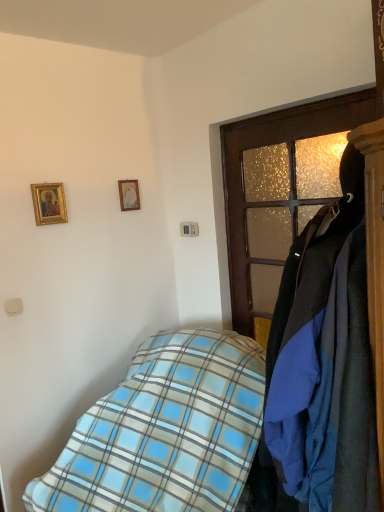
Question: Is gold-framed painting at upper left, the 1th picture frame from the left, taller than wooden door at right?

Choices:
 (A) yes
 (B) no

Answer: (B)

Question: From the image's perspective, is gold-framed painting at upper left, which is counted as the 2th picture frame, starting from the right, beneath wooden door at right?

Choices:
 (A) yes
 (B) no

Answer: (B)

Question: Is gold-framed painting at upper left, acting as the second picture frame starting from the back, located outside wooden door at right?

Choices:
 (A) yes
 (B) no

Answer: (A)

Question: Considering the relative sizes of gold-framed painting at upper left, acting as the second picture frame starting from the back, and wooden door at right in the image provided, is gold-framed painting at upper left, acting as the second picture frame starting from the back, shorter than wooden door at right?

Choices:
 (A) no
 (B) yes

Answer: (B)

Question: Considering the relative sizes of gold-framed painting at upper left, which is the 1th picture frame in front-to-back order, and wooden door at right in the image provided, is gold-framed painting at upper left, which is the 1th picture frame in front-to-back order, wider than wooden door at right?

Choices:
 (A) yes
 (B) no

Answer: (B)

Question: Is point (279, 243) closer or farther from the camera than point (62, 201)?

Choices:
 (A) farther
 (B) closer

Answer: (B)

Question: From a real-world perspective, is wooden door at right positioned above or below gold-framed painting at upper left, which is counted as the 2th picture frame, starting from the right?

Choices:
 (A) above
 (B) below

Answer: (B)

Question: Is wooden door at right wider or thinner than gold-framed painting at upper left, which is counted as the 2th picture frame, starting from the right?

Choices:
 (A) thin
 (B) wide

Answer: (B)

Question: In the image, is wooden door at right positioned in front of or behind gold-framed painting at upper left, the 1th picture frame from the left?

Choices:
 (A) front
 (B) behind

Answer: (A)

Question: Would you say blue plaid blanket at lower left, which is counted as the first bed, starting from the back, is inside or outside gold-framed painting at upper left, the 1th picture frame from the left?

Choices:
 (A) outside
 (B) inside

Answer: (A)

Question: From a real-world perspective, is blue plaid blanket at lower left, arranged as the second bed when viewed from the front, physically located above or below gold-framed painting at upper left, which is the 1th picture frame in front-to-back order?

Choices:
 (A) above
 (B) below

Answer: (B)

Question: Is blue plaid blanket at lower left, which is counted as the first bed, starting from the back, in front of or behind gold-framed painting at upper left, the 1th picture frame from the left, in the image?

Choices:
 (A) behind
 (B) front

Answer: (B)

Question: Is point (165, 442) positioned closer to the camera than point (59, 199)?

Choices:
 (A) closer
 (B) farther

Answer: (A)

Question: Considering the positions of blue plaid blanket at lower left, the second bed viewed from the back, and blue plaid blanket at lower left, arranged as the second bed when viewed from the front, in the image, is blue plaid blanket at lower left, the second bed viewed from the back, bigger or smaller than blue plaid blanket at lower left, arranged as the second bed when viewed from the front,?

Choices:
 (A) big
 (B) small

Answer: (B)

Question: In terms of width, does blue plaid blanket at lower left, the second bed viewed from the back, look wider or thinner when compared to blue plaid blanket at lower left, which is counted as the first bed, starting from the back?

Choices:
 (A) thin
 (B) wide

Answer: (A)